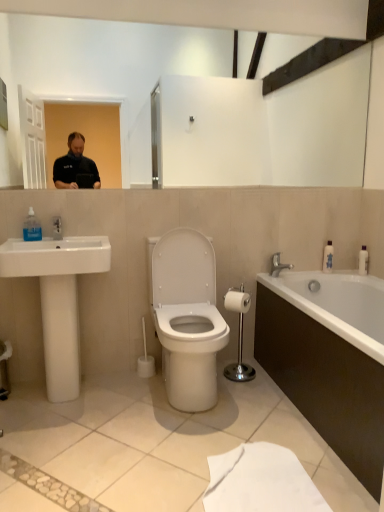
Question: Is point (289, 264) closer or farther from the camera than point (360, 265)?

Choices:
 (A) farther
 (B) closer

Answer: (B)

Question: From the image's perspective, is silver metallic faucet at right above or below white plastic bottle at right, arranged as the 1th toiletry when viewed from the right?

Choices:
 (A) above
 (B) below

Answer: (B)

Question: Estimate the real-world distances between objects in this image. Which object is farther from the white glossy bottle at right, arranged as the 2th toiletry when viewed from the right?

Choices:
 (A) white ceramic sink at left
 (B) white plastic toilet brush at center
 (C) white plastic bottle at right, the 2th toiletry in the left-to-right sequence
 (D) transparent plastic soap dispenser at left
 (E) silver metallic faucet at right

Answer: (D)

Question: Which of these objects is positioned closest to the silver metallic faucet at right?

Choices:
 (A) white glossy bathtub at lower right
 (B) white matte toilet paper at center-right
 (C) white ceramic sink at left
 (D) white glossy bottle at right, arranged as the 2th toiletry when viewed from the right
 (E) white plastic toilet brush at center

Answer: (D)